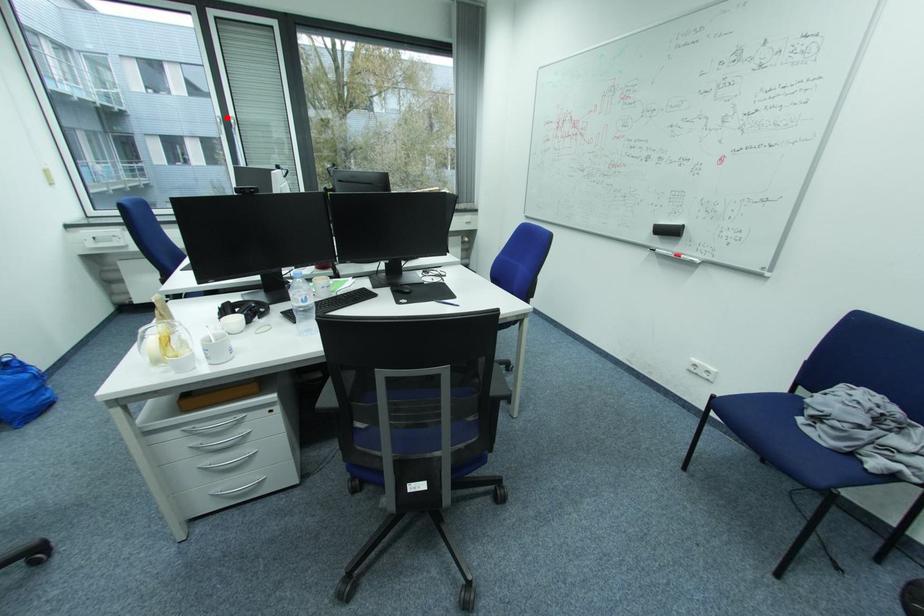
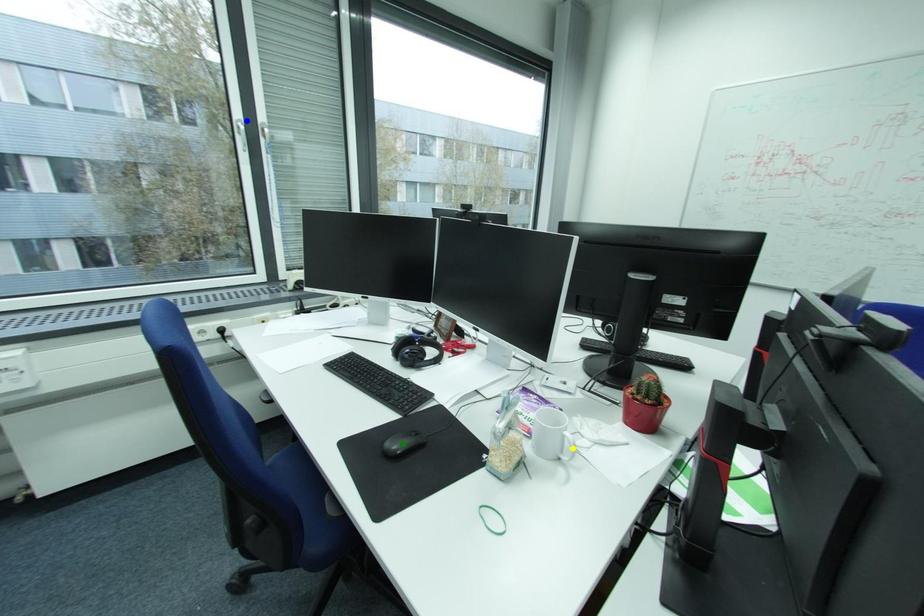
Question: I am providing you with two images of the same scene from different viewpoints. A red point is marked on the first image. You are given multiple points on the second image. Which mark in image 2 goes with the point in image 1?

Choices:
 (A) yellow point
 (B) green point
 (C) blue point

Answer: (C)